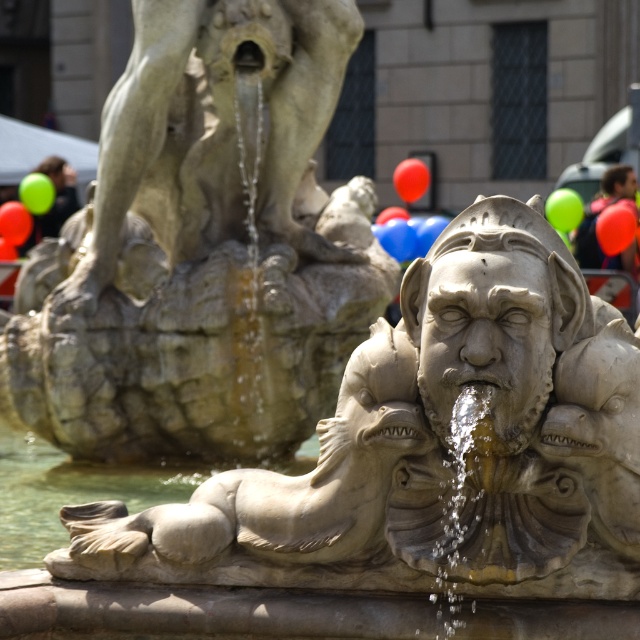
You are standing in a public square and see the stone fountain at center and the blurred hair at center. Which object is more to the left?

The stone fountain at center is positioned on the left side of blurred hair at center, so it is more to the left.

You are an artist trying to sketch the scene. You need to know which object is wider to scale them correctly. Which is wider, the stone fountain at center or the blurred hair at center?

The stone fountain at center is wider than the blurred hair at center according to the description.

You are standing in a public square and see the stone fountain at center and the blurred hair at center. Which object is closer to you?

The stone fountain at center is closer to you because it is in front of the blurred hair at center.